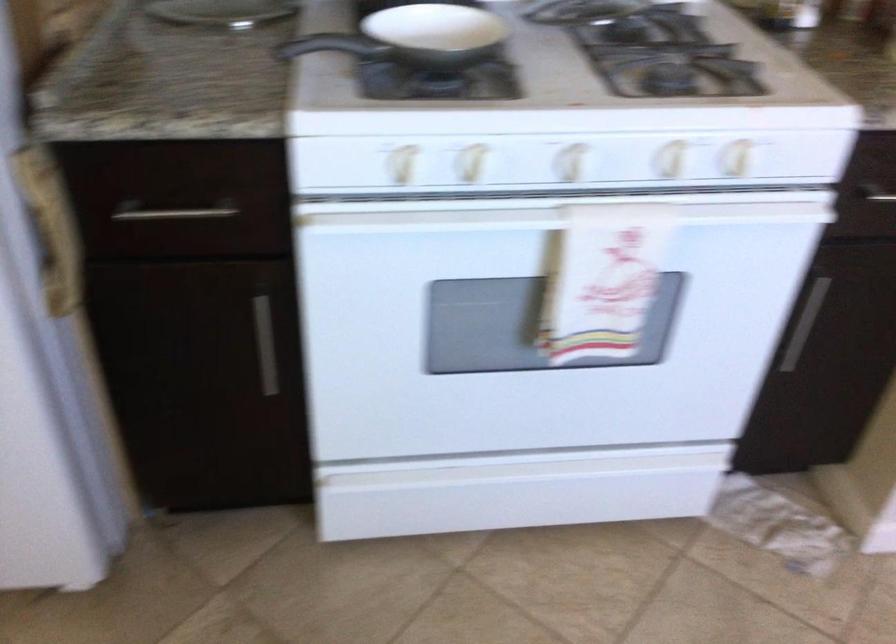
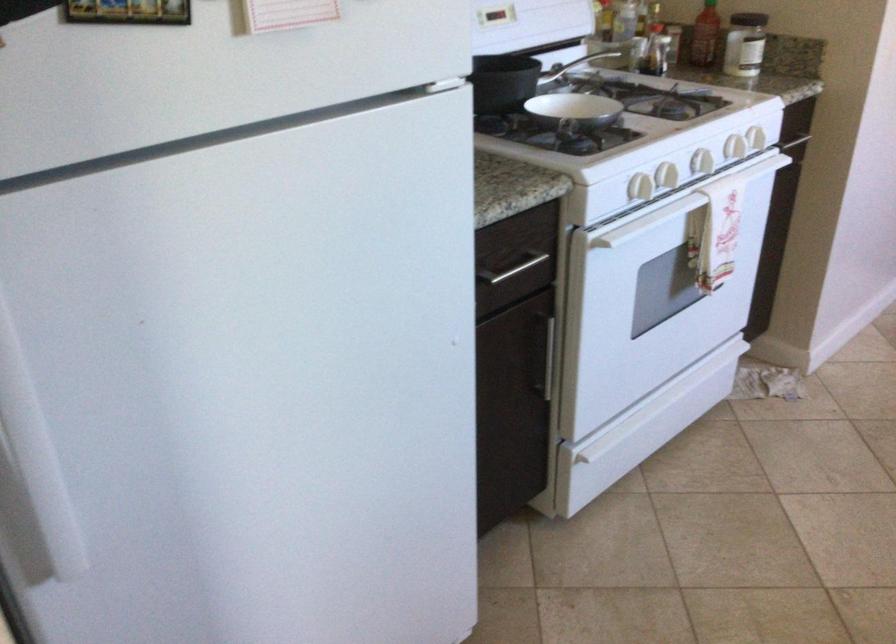
Where in the second image is the point corresponding to (x=411, y=202) from the first image?

(666, 176)